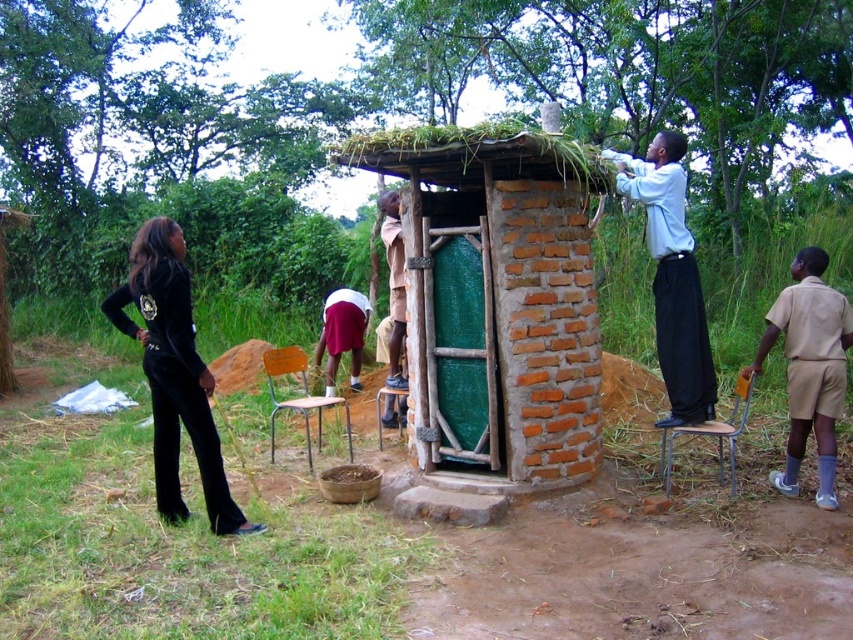
Question: Does black velvet pants at left have a larger size compared to beige uniform at right?

Choices:
 (A) yes
 (B) no

Answer: (A)

Question: Observing the image, what is the correct spatial positioning of light blue shirt at upper right in reference to beige uniform at right?

Choices:
 (A) left
 (B) right

Answer: (A)

Question: Is green mesh door at center closer to camera compared to beige uniform at right?

Choices:
 (A) no
 (B) yes

Answer: (B)

Question: Which object appears closest to the camera in this image?

Choices:
 (A) beige uniform at right
 (B) light blue shirt at upper right

Answer: (A)

Question: Which point is farther to the camera?

Choices:
 (A) green mesh door at center
 (B) beige uniform at right
 (C) light blue shirt at upper right
 (D) black velvet pants at left

Answer: (C)

Question: Which point is farther to the camera?

Choices:
 (A) green mesh door at center
 (B) black velvet pants at left
 (C) beige uniform at right
 (D) light blue shirt at upper right

Answer: (D)